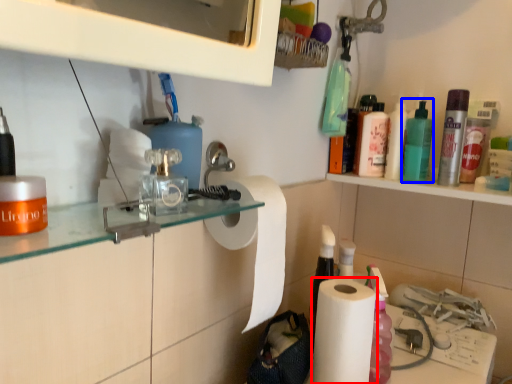
Question: Which point is further to the camera, paper towel (highlighted by a red box) or mouthwash (highlighted by a blue box)?

Choices:
 (A) paper towel
 (B) mouthwash

Answer: (B)